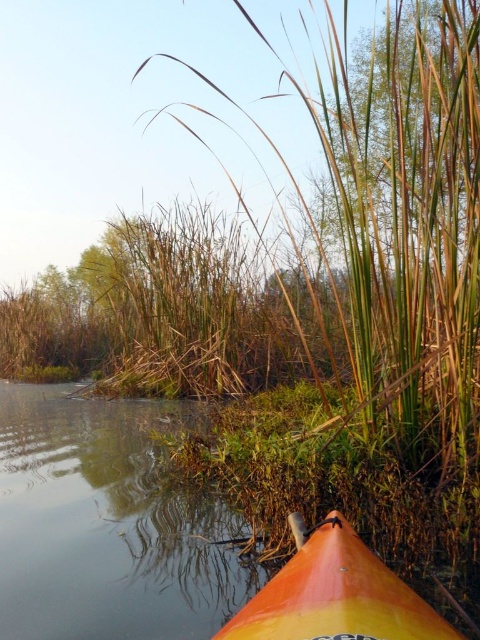
You are a kayaker navigating a serene waterway surrounded by tall reeds. You notice a point marked at coordinates (107, 524). What object does this point correspond to in the scene?

The point at coordinates (107, 524) corresponds to the smooth orange kayak at lower right.